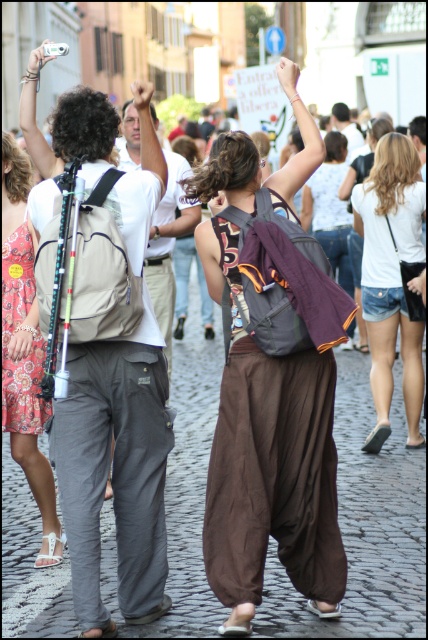
Can you confirm if matte gray backpack at center is wider than matte gray pants at center?

No.

Is matte gray backpack at center to the right of matte gray pants at center from the viewer's perspective?

Correct, you'll find matte gray backpack at center to the right of matte gray pants at center.

Measure the distance between point [329,392] and camera.

21.71 meters

Where is `matte gray backpack at center`? matte gray backpack at center is located at coordinates (269, 460).

Is matte gray backpack at center further to the viewer compared to floral print dress at center?

Yes, it is behind floral print dress at center.

Is matte gray backpack at center thinner than floral print dress at center?

Indeed, matte gray backpack at center has a lesser width compared to floral print dress at center.

Who is more distant from viewer, (208, 561) or (5, 316)?

The point (5, 316) is behind.

The width and height of the screenshot is (428, 640). In order to click on matte gray backpack at center in this screenshot , I will do `click(269, 460)`.

Consider the image. Who is positioned more to the left, matte purple backpack at center or matte white camera at upper left?

From the viewer's perspective, matte white camera at upper left appears more on the left side.

Does matte purple backpack at center have a larger size compared to matte white camera at upper left?

Incorrect, matte purple backpack at center is not larger than matte white camera at upper left.

Does point (330, 227) come farther from viewer compared to point (41, 52)?

Yes, it is.

Identify the location of matte purple backpack at center. The width and height of the screenshot is (428, 640). (329, 209).